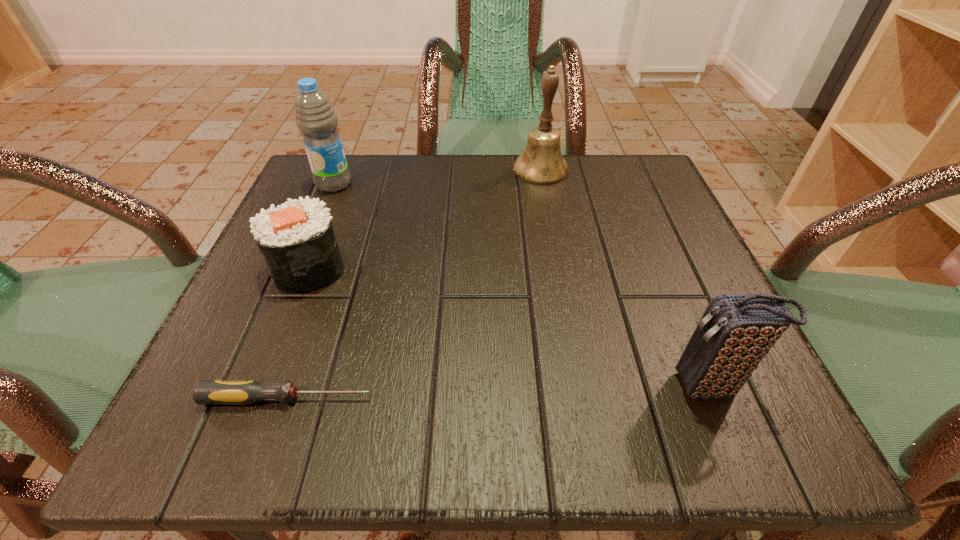
The height and width of the screenshot is (540, 960). Identify the location of free space located with the zip open on the clutch bag. (503, 386).

This screenshot has width=960, height=540. Identify the location of free space located 0.270m with the zip open on the clutch bag. click(x=465, y=386).

Where is `free space located 0.320m on the right of the third nearest object`? Image resolution: width=960 pixels, height=540 pixels. free space located 0.320m on the right of the third nearest object is located at coordinates (536, 268).

Image resolution: width=960 pixels, height=540 pixels. I want to click on blank space located 0.210m insert the screwdriver into a screw head, so click(x=534, y=399).

Identify the location of bell at the far edge. This screenshot has height=540, width=960. (541, 163).

This screenshot has height=540, width=960. In order to click on water bottle that is at the far edge in this screenshot , I will do `click(315, 117)`.

Where is `clutch bag that is positioned at the near edge`? clutch bag that is positioned at the near edge is located at coordinates (735, 333).

At what (x,y) coordinates should I click in order to perform the action: click on screwdriver situated at the near edge. Please return your answer as a coordinate pair (x, y). The width and height of the screenshot is (960, 540). Looking at the image, I should click on (241, 392).

Find the location of a particular element. water bottle situated at the left edge is located at coordinates (315, 117).

At what (x,y) coordinates should I click in order to perform the action: click on sushi present at the left edge. Please return your answer as a coordinate pair (x, y). This screenshot has width=960, height=540. Looking at the image, I should click on (296, 239).